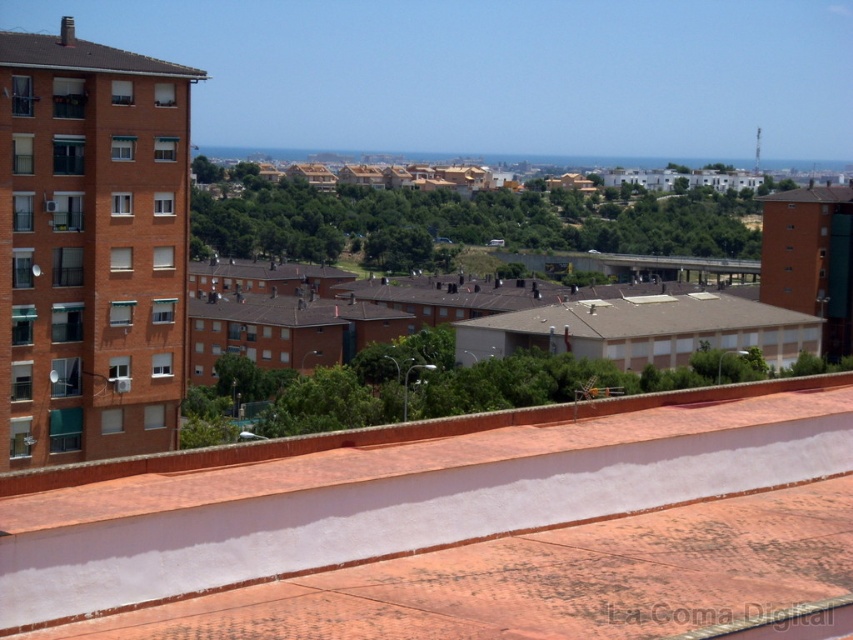
Is brown/flat roof at center wider than brown tiled roof at upper left?

Correct, the width of brown/flat roof at center exceeds that of brown tiled roof at upper left.

The height and width of the screenshot is (640, 853). In order to click on brown/flat roof at center in this screenshot , I will do `click(642, 317)`.

Which is behind, point (607, 332) or point (51, 51)?

Positioned behind is point (607, 332).

Find the location of `brown/flat roof at center`. brown/flat roof at center is located at coordinates (642, 317).

Is the position of white smooth roof at center less distant than that of brown tiled roof at upper left?

That is True.

Locate an element on the screen. This screenshot has height=640, width=853. white smooth roof at center is located at coordinates (453, 525).

The height and width of the screenshot is (640, 853). Find the location of `white smooth roof at center`. white smooth roof at center is located at coordinates (453, 525).

Locate an element on the screen. The height and width of the screenshot is (640, 853). white smooth roof at center is located at coordinates (453, 525).

Is white smooth roof at center positioned before brown tile roof at upper right?

Yes, white smooth roof at center is closer to the viewer.

You are a GUI agent. You are given a task and a screenshot of the screen. Output one action in this format:
    pyautogui.click(x=<x>, y=<y>)
    Task: Click on the white smooth roof at center
    The width and height of the screenshot is (853, 640).
    Given the screenshot: What is the action you would take?
    pyautogui.click(x=453, y=525)

Is point (627, 582) positioned after point (819, 188)?

No, it is in front of (819, 188).

Where is `white smooth roof at center`? The height and width of the screenshot is (640, 853). white smooth roof at center is located at coordinates (453, 525).